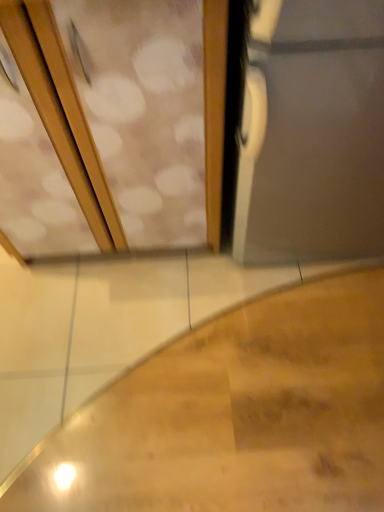
Locate an element on the screen. Image resolution: width=384 pixels, height=512 pixels. wooden stairs at lower left is located at coordinates (237, 414).

Measure the distance between wooden stairs at lower left and camera.

A distance of 96.26 centimeters exists between wooden stairs at lower left and camera.

This screenshot has width=384, height=512. Describe the element at coordinates (237, 414) in the screenshot. I see `wooden stairs at lower left` at that location.

Measure the distance between wooden screen door at upper left and camera.

They are 23.19 inches apart.

Where is `wooden screen door at upper left`? Image resolution: width=384 pixels, height=512 pixels. wooden screen door at upper left is located at coordinates (61, 112).

In order to face wooden screen door at upper left, should I rotate leftwards or rightwards?

To face it directly, rotate left by 12.733 degrees.

The image size is (384, 512). What do you see at coordinates (61, 112) in the screenshot?
I see `wooden screen door at upper left` at bounding box center [61, 112].

Where is `wooden stairs at lower left`? This screenshot has width=384, height=512. wooden stairs at lower left is located at coordinates (237, 414).

Is wooden screen door at upper left to the left of wooden stairs at lower left from the viewer's perspective?

Correct, you'll find wooden screen door at upper left to the left of wooden stairs at lower left.

Does wooden screen door at upper left lie behind wooden stairs at lower left?

No.

Is point (3, 14) more distant than point (233, 435)?

No, (3, 14) is in front of (233, 435).

From the image's perspective, is wooden screen door at upper left located above or below wooden stairs at lower left?

wooden screen door at upper left is above wooden stairs at lower left.

From a real-world perspective, which object rests below the other?

wooden stairs at lower left, from a real-world perspective.

Does wooden screen door at upper left have a lesser width compared to wooden stairs at lower left?

Yes.

Does wooden screen door at upper left have a lesser height compared to wooden stairs at lower left?

No, wooden screen door at upper left is not shorter than wooden stairs at lower left.

Based on the photo, which of these two, wooden screen door at upper left or wooden stairs at lower left, is bigger?

wooden screen door at upper left is bigger.

Would you say wooden screen door at upper left is inside or outside wooden stairs at lower left?

The correct answer is: outside.

Are wooden screen door at upper left and wooden stairs at lower left located far from each other?

No, there isn't a large distance between wooden screen door at upper left and wooden stairs at lower left.

Is wooden screen door at upper left facing towards wooden stairs at lower left?

Yes, wooden screen door at upper left faces towards wooden stairs at lower left.

What's the angular difference between wooden screen door at upper left and wooden stairs at lower left's facing directions?

There is a 89.2-degree angle between the facing directions of wooden screen door at upper left and wooden stairs at lower left.

Find the location of a particular element. Image resolution: width=384 pixels, height=512 pixels. screen door above the wooden stairs at lower left (from a real-world perspective) is located at coordinates (61, 112).

From the picture: Considering the positions of objects wooden stairs at lower left and wooden screen door at upper left in the image provided, who is more to the left, wooden stairs at lower left or wooden screen door at upper left?

Positioned to the left is wooden screen door at upper left.

Which object is closer to the camera taking this photo, wooden stairs at lower left or wooden screen door at upper left?

wooden screen door at upper left is closer to the camera.

Does point (208, 322) lie in front of point (18, 22)?

No, (208, 322) is behind (18, 22).

From the image's perspective, between wooden stairs at lower left and wooden screen door at upper left, which one is located above?

wooden screen door at upper left.

From the picture: From a real-world perspective, is wooden stairs at lower left above or below wooden screen door at upper left?

wooden stairs at lower left is below wooden screen door at upper left.

Considering the sizes of objects wooden stairs at lower left and wooden screen door at upper left in the image provided, who is thinner, wooden stairs at lower left or wooden screen door at upper left?

wooden screen door at upper left is thinner.

Considering the sizes of objects wooden stairs at lower left and wooden screen door at upper left in the image provided, who is taller, wooden stairs at lower left or wooden screen door at upper left?

Standing taller between the two is wooden screen door at upper left.

Considering the sizes of objects wooden stairs at lower left and wooden screen door at upper left in the image provided, who is bigger, wooden stairs at lower left or wooden screen door at upper left?

Bigger between the two is wooden screen door at upper left.

Is wooden stairs at lower left not inside wooden screen door at upper left?

wooden stairs at lower left is positioned outside wooden screen door at upper left.

Does wooden stairs at lower left touch wooden screen door at upper left?

No, wooden stairs at lower left is not touching wooden screen door at upper left.

Is wooden stairs at lower left oriented away from wooden screen door at upper left?

wooden stairs at lower left does not have its back to wooden screen door at upper left.

Can you tell me how much wooden stairs at lower left and wooden screen door at upper left differ in facing direction?

The angular difference between wooden stairs at lower left and wooden screen door at upper left is 89.2 degrees.

Locate an element on the screen. The height and width of the screenshot is (512, 384). stairs on the right of the wooden screen door at upper left is located at coordinates (237, 414).

The image size is (384, 512). Identify the location of stairs that appears below the wooden screen door at upper left (from a real-world perspective). (237, 414).

Find the location of a particular element. This screenshot has width=384, height=512. screen door in front of the wooden stairs at lower left is located at coordinates (61, 112).